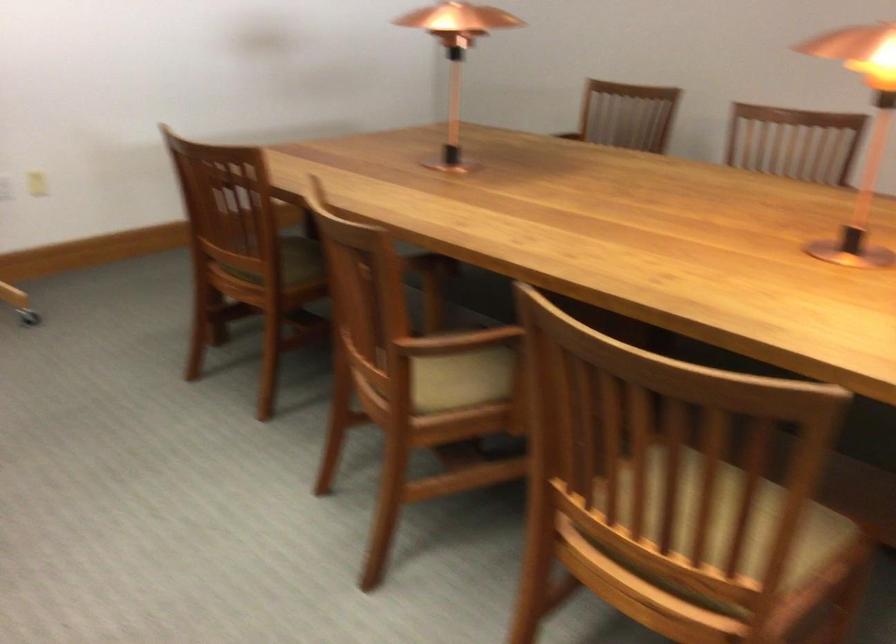
Identify the location of wooden chair armrest. (455, 342).